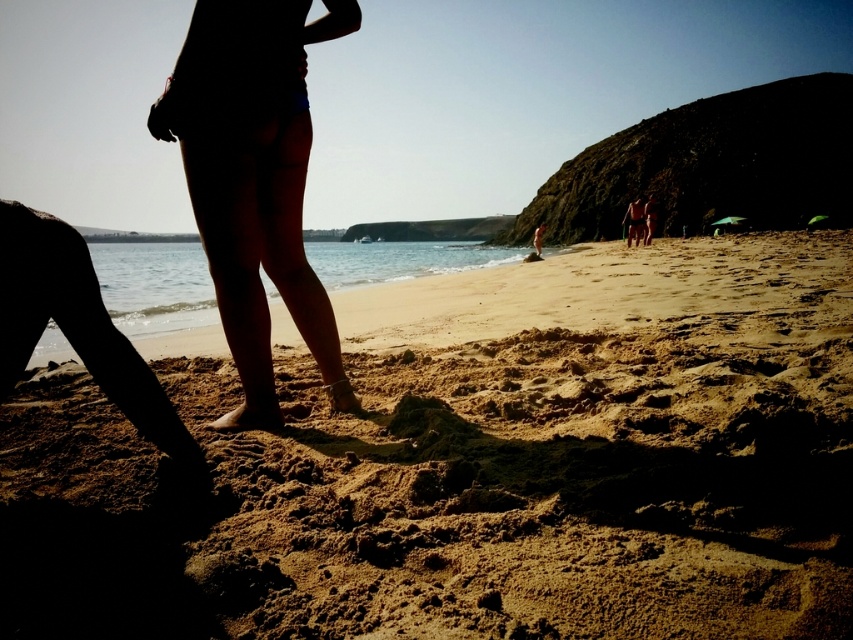
Which is below, fine-grained sand at lower center or smooth skin bikini bottom at center?

fine-grained sand at lower center is below.

Can you confirm if fine-grained sand at lower center is wider than smooth skin bikini bottom at center?

Correct, the width of fine-grained sand at lower center exceeds that of smooth skin bikini bottom at center.

Between point (126, 541) and point (223, 148), which one is positioned in front?

Point (126, 541)

What are the coordinates of `fine-grained sand at lower center` in the screenshot? It's located at (474, 477).